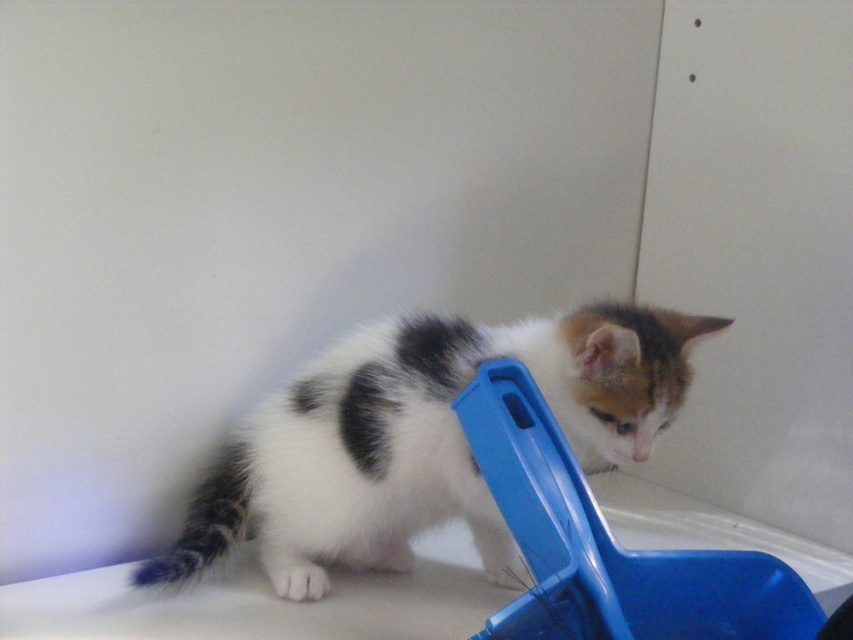
You are a photographer trying to capture a closeup shot of the white fur cat at center. The camera you are using has a minimum focusing distance of 3 feet. Will you be able to take the photo without moving closer?

The white fur cat at center is 3.78 feet away from the camera, which is beyond the minimum focusing distance of 3 feet. Therefore, you can take the closeup shot without moving closer.

You are a pet owner who wants to place a toy for your cat to play with. You have a blue plastic scoop at lower center. Where should you place the toy so the cat at white fur cat at center can easily reach it?

Since the white fur cat at center is positioned over the blue plastic scoop at lower center, placing the toy near the blue plastic scoop at lower center would ensure the cat can easily reach it.

You are a cat owner who wants to ensure your cat can reach its food bowl. The blue plastic scoop at lower center is used to serve food. If the white fur cat at center needs to be within 8 inches to comfortably reach the scoop, is the current distance sufficient?

The white fur cat at center is 7.38 inches from the blue plastic scoop at lower center, which is within the 8 inch requirement, so the distance is sufficient for the cat to comfortably reach the scoop.